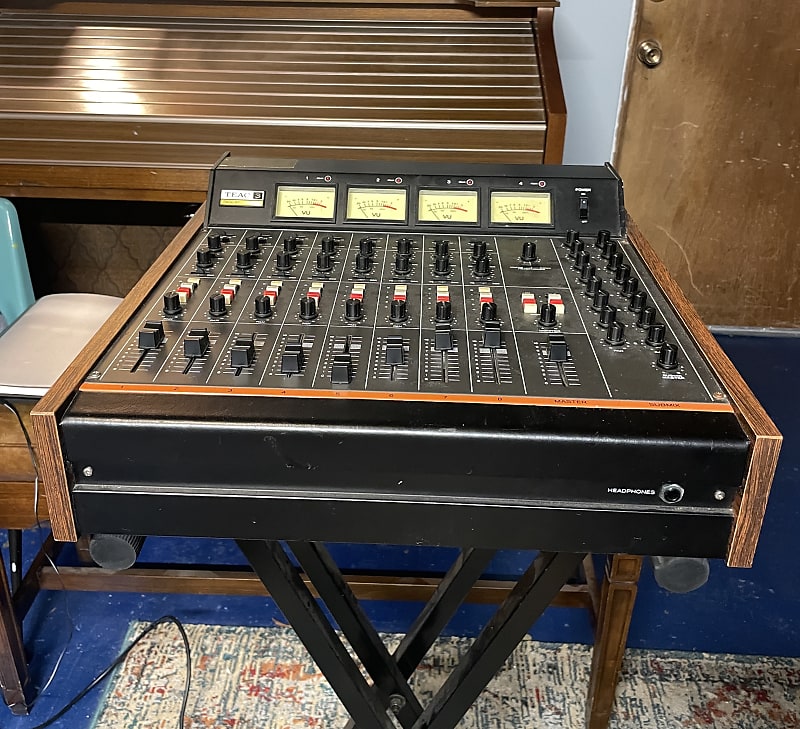
Where is `white seat`? The image size is (800, 729). white seat is located at coordinates [x=60, y=345].